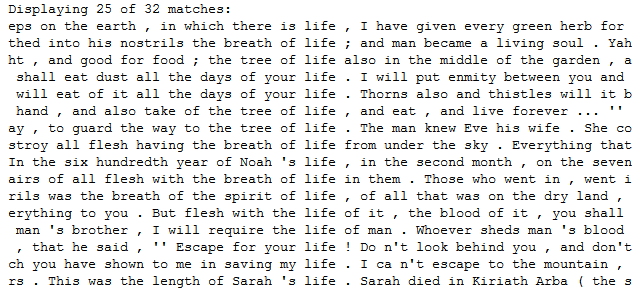
Identify the location of wall. This screenshot has width=640, height=292. (169, 227).